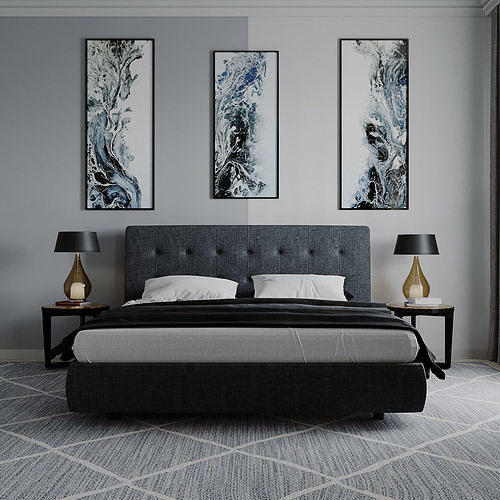
This screenshot has width=500, height=500. I want to click on table, so click(47, 308), click(437, 314).